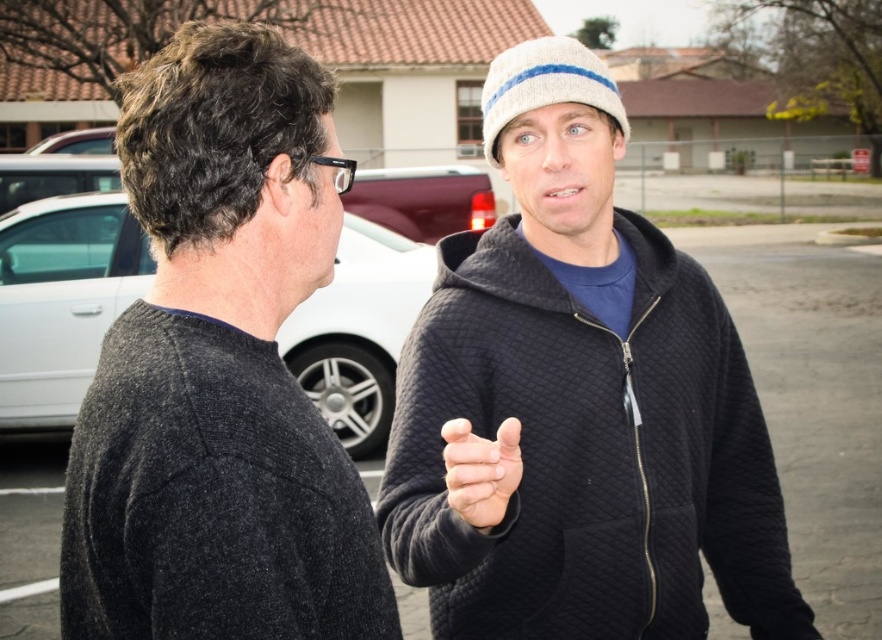
Is black quilted sweatshirt at center closer to the viewer compared to matte gray sedan at left?

Yes, black quilted sweatshirt at center is closer to the viewer.

Can you confirm if black quilted sweatshirt at center is bigger than matte gray sedan at left?

Incorrect, black quilted sweatshirt at center is not larger than matte gray sedan at left.

Who is more forward, [677,376] or [24,426]?

Point [677,376]

This screenshot has height=640, width=882. I want to click on black quilted sweatshirt at center, so click(587, 454).

Can you confirm if dark gray sweater at left is bigger than black quilted sweatshirt at center?

Incorrect, dark gray sweater at left is not larger than black quilted sweatshirt at center.

Can you confirm if dark gray sweater at left is thinner than black quilted sweatshirt at center?

Correct, dark gray sweater at left's width is less than black quilted sweatshirt at center's.

Who is more forward, (219, 65) or (624, 589)?

Positioned in front is point (219, 65).

Find the location of a particular element. Image resolution: width=882 pixels, height=640 pixels. dark gray sweater at left is located at coordinates (220, 371).

Can you confirm if matte red truck at center is positioned to the left of white matte hand at center?

In fact, matte red truck at center is to the right of white matte hand at center.

Between point (468, 193) and point (514, 435), which one is positioned behind?

Positioned behind is point (468, 193).

The width and height of the screenshot is (882, 640). Identify the location of matte red truck at center. (423, 198).